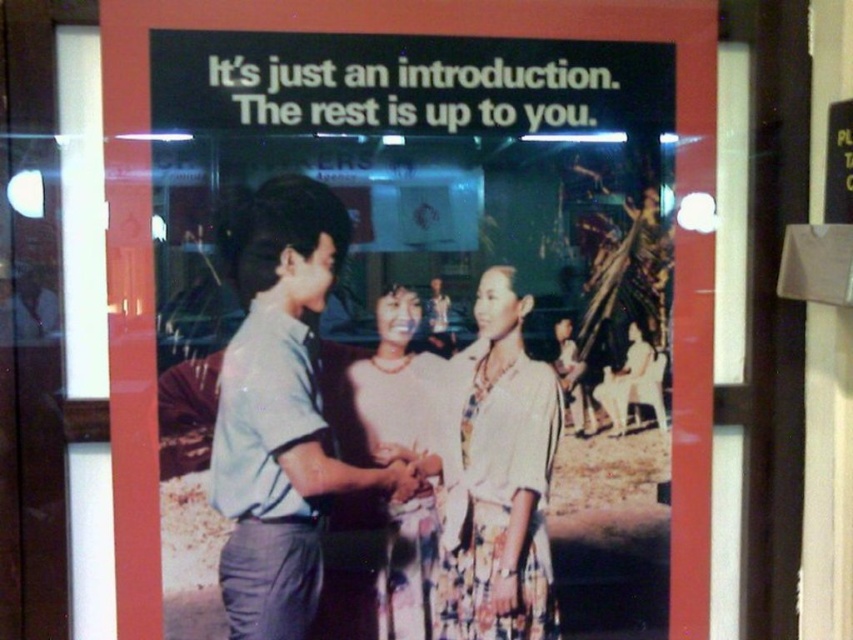
You are an art curator planning to hang a new painting that is 14 inches wide between the matte paper poster at center and the printed silk blouse at center in the image. Will there be enough space?

The matte paper poster at center is 13.93 inches from the printed silk blouse at center. Since the new painting is 14 inches wide, it will not fit between them as the available space is slightly smaller than the painting.

Based on the scene described, which object is positioned higher in the image between the light blue shirt at center and the matte white blouse at center?

The light blue shirt at center is positioned higher than the matte white blouse at center according to the description.